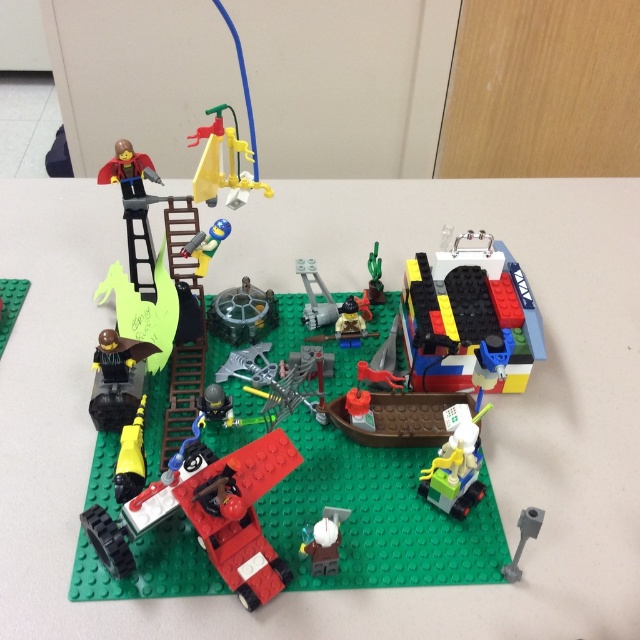
Question: Considering the relative positions of brick-like colorful container at center-right and white matte candle at center in the image provided, where is brick-like colorful container at center-right located with respect to white matte candle at center?

Choices:
 (A) below
 (B) above

Answer: (B)

Question: Is brick-like colorful container at center-right below matte black figure at lower left?

Choices:
 (A) no
 (B) yes

Answer: (A)

Question: Among these objects, which one is farthest from the camera?

Choices:
 (A) matte black figure at left
 (B) brick-like colorful container at center-right
 (C) matte black figure at lower left
 (D) brick red plastic airplane at center

Answer: (A)

Question: Which object is closer to the camera taking this photo?

Choices:
 (A) yellow plastic lever at upper center
 (B) brick red plastic airplane at center
 (C) white matte candle at center

Answer: (B)

Question: Which point is farther to the camera?

Choices:
 (A) (451, 456)
 (B) (230, 195)

Answer: (B)

Question: Does green matte baseplate at center appear over metallic gray gear at center?

Choices:
 (A) yes
 (B) no

Answer: (B)